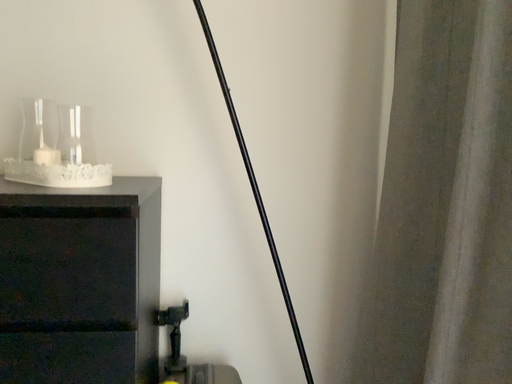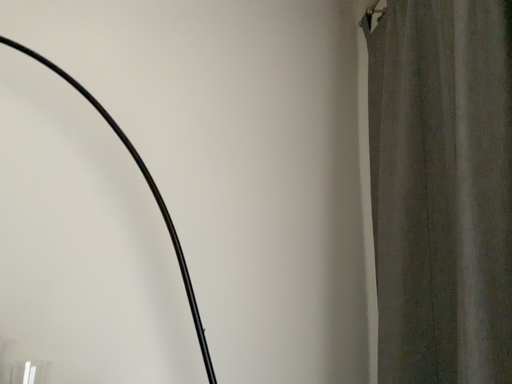
Question: How did the camera likely rotate when shooting the video?

Choices:
 (A) rotated upward
 (B) rotated downward

Answer: (A)